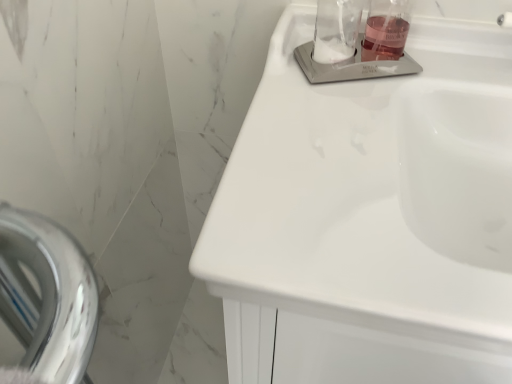
You are a GUI agent. You are given a task and a screenshot of the screen. Output one action in this format:
    pyautogui.click(x=<x>, y=<y>)
    Task: Click on the vacant area that is situated to the right of clear glass soap dispenser at upper right, positioned as the second sink in front-to-back order
    The height and width of the screenshot is (384, 512).
    Given the screenshot: What is the action you would take?
    (444, 74)